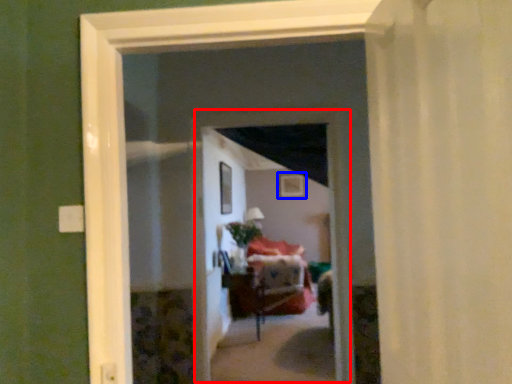
Question: Which object is closer to the camera taking this photo, screen door (highlighted by a red box) or picture frame (highlighted by a blue box)?

Choices:
 (A) screen door
 (B) picture frame

Answer: (A)